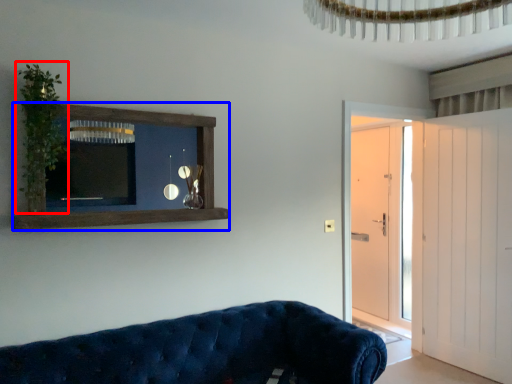
Question: Which object is closer to the camera taking this photo, plant (highlighted by a red box) or shelf (highlighted by a blue box)?

Choices:
 (A) plant
 (B) shelf

Answer: (A)